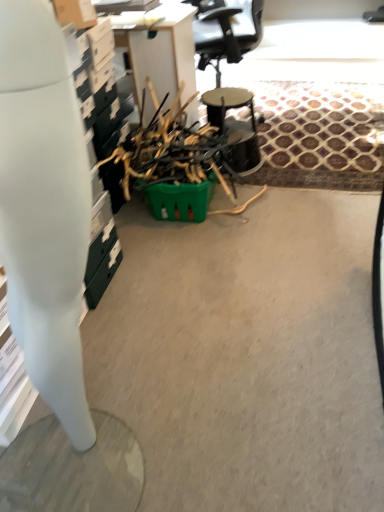
Question: Should I look upward or downward to see green plastic basket at center?

Choices:
 (A) up
 (B) down

Answer: (A)

Question: Does white glossy desk at left have a larger size compared to green plastic basket at center?

Choices:
 (A) yes
 (B) no

Answer: (B)

Question: Is white glossy desk at left oriented away from green plastic basket at center?

Choices:
 (A) yes
 (B) no

Answer: (B)

Question: Can you confirm if white glossy desk at left is shorter than green plastic basket at center?

Choices:
 (A) no
 (B) yes

Answer: (A)

Question: Is white glossy desk at left positioned behind green plastic basket at center?

Choices:
 (A) no
 (B) yes

Answer: (A)

Question: Is white glossy desk at left wider than green plastic basket at center?

Choices:
 (A) no
 (B) yes

Answer: (A)

Question: Would you consider white glossy desk at left to be distant from green plastic basket at center?

Choices:
 (A) yes
 (B) no

Answer: (A)

Question: Is white glossy desk at left smaller than metallic black drum at center?

Choices:
 (A) yes
 (B) no

Answer: (B)

Question: Could you tell me if white glossy desk at left is turned towards metallic black drum at center?

Choices:
 (A) yes
 (B) no

Answer: (B)

Question: Considering the relative sizes of white glossy desk at left and metallic black drum at center in the image provided, is white glossy desk at left thinner than metallic black drum at center?

Choices:
 (A) yes
 (B) no

Answer: (A)

Question: Is white glossy desk at left bigger than metallic black drum at center?

Choices:
 (A) no
 (B) yes

Answer: (B)

Question: Are white glossy desk at left and metallic black drum at center beside each other?

Choices:
 (A) yes
 (B) no

Answer: (B)

Question: From the image's perspective, is white glossy desk at left located beneath metallic black drum at center?

Choices:
 (A) no
 (B) yes

Answer: (B)

Question: From a real-world perspective, is metallic black drum at center below green plastic basket at center?

Choices:
 (A) yes
 (B) no

Answer: (A)